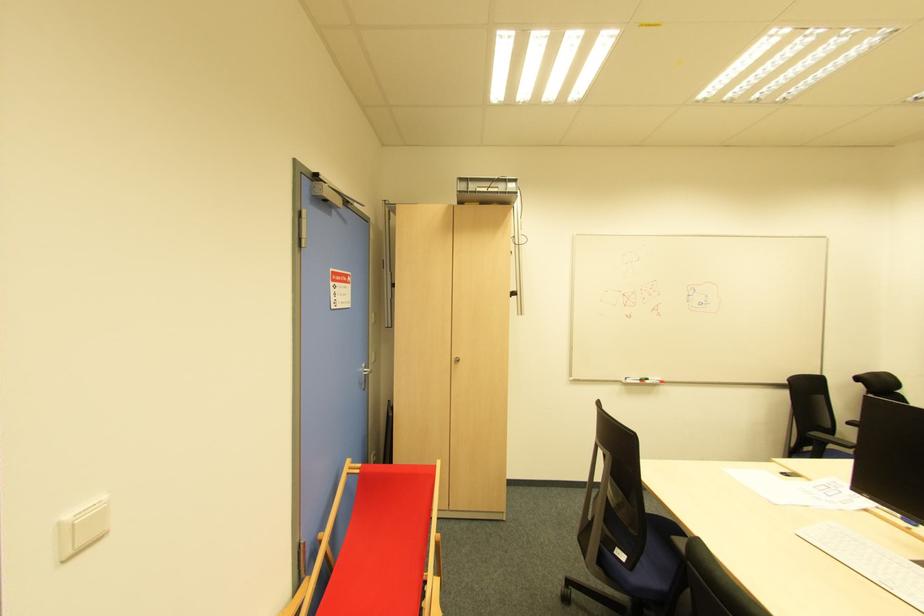
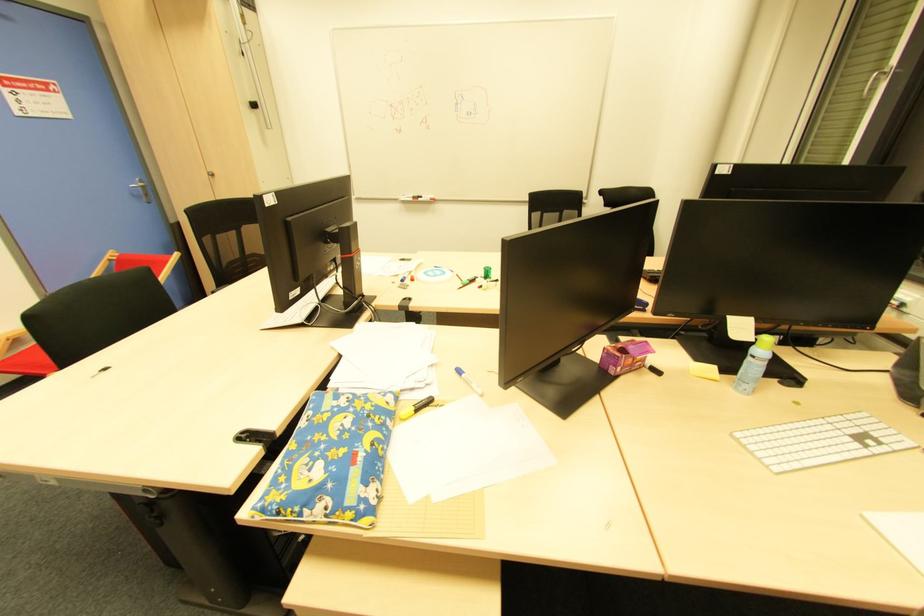
Question: In a continuous first-person perspective shot, in which direction is the camera moving?

Choices:
 (A) Left
 (B) Right
 (C) Forward
 (D) Backward

Answer: (B)